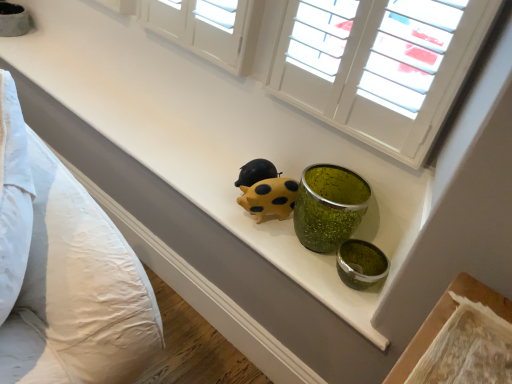
Question: Should I look upward or downward to see yellow matte rubber ladybug at center?

Choices:
 (A) up
 (B) down

Answer: (B)

Question: Are white textured shutters at upper center and yellow matte rubber ladybug at center located far from each other?

Choices:
 (A) yes
 (B) no

Answer: (B)

Question: Considering the relative sizes of white textured shutters at upper center and yellow matte rubber ladybug at center in the image provided, is white textured shutters at upper center taller than yellow matte rubber ladybug at center?

Choices:
 (A) no
 (B) yes

Answer: (B)

Question: Is white textured shutters at upper center wider than yellow matte rubber ladybug at center?

Choices:
 (A) yes
 (B) no

Answer: (B)

Question: Does white textured shutters at upper center lie in front of yellow matte rubber ladybug at center?

Choices:
 (A) no
 (B) yes

Answer: (B)

Question: Can you confirm if white textured shutters at upper center is smaller than yellow matte rubber ladybug at center?

Choices:
 (A) yes
 (B) no

Answer: (B)

Question: From a real-world perspective, is white textured shutters at upper center beneath yellow matte rubber ladybug at center?

Choices:
 (A) no
 (B) yes

Answer: (A)

Question: Can we say yellow matte rubber ladybug at center lies outside white cotton pillows at left?

Choices:
 (A) no
 (B) yes

Answer: (B)

Question: From a real-world perspective, is yellow matte rubber ladybug at center positioned under white cotton pillows at left based on gravity?

Choices:
 (A) yes
 (B) no

Answer: (A)

Question: From a real-world perspective, is yellow matte rubber ladybug at center on top of white cotton pillows at left?

Choices:
 (A) no
 (B) yes

Answer: (A)

Question: From the image's perspective, is yellow matte rubber ladybug at center under white cotton pillows at left?

Choices:
 (A) no
 (B) yes

Answer: (A)

Question: Could you tell me if yellow matte rubber ladybug at center is facing white cotton pillows at left?

Choices:
 (A) yes
 (B) no

Answer: (A)

Question: Is yellow matte rubber ladybug at center not close to white cotton pillows at left?

Choices:
 (A) yes
 (B) no

Answer: (B)

Question: Is yellow matte rubber ladybug at center to the left of white textured shutters at upper center from the viewer's perspective?

Choices:
 (A) no
 (B) yes

Answer: (B)